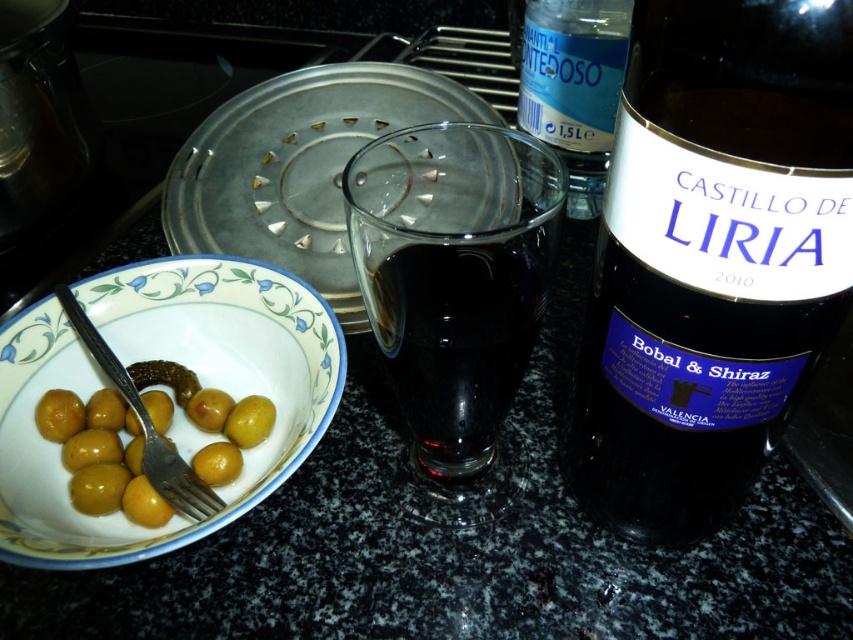
Question: Which object is positioned farthest from the white glossy plate at lower left?

Choices:
 (A) transparent plastic bottle at upper center
 (B) silver metallic fork at lower left
 (C) dark glass bottle at right

Answer: (A)

Question: Which of these objects is positioned closest to the transparent plastic bottle at upper center?

Choices:
 (A) dark glass bottle at right
 (B) silver metallic fork at lower left
 (C) white glossy plate at lower left

Answer: (A)

Question: Does dark glass bottle at right appear on the left side of transparent plastic bottle at upper center?

Choices:
 (A) no
 (B) yes

Answer: (A)

Question: Does transparent plastic bottle at upper center appear under silver metallic fork at lower left?

Choices:
 (A) no
 (B) yes

Answer: (A)

Question: Can you confirm if dark glass bottle at right is thinner than white glossy plate at lower left?

Choices:
 (A) yes
 (B) no

Answer: (A)

Question: Which of the following is the closest to the observer?

Choices:
 (A) (567, 179)
 (B) (656, 282)
 (C) (171, 497)
 (D) (64, 525)

Answer: (B)